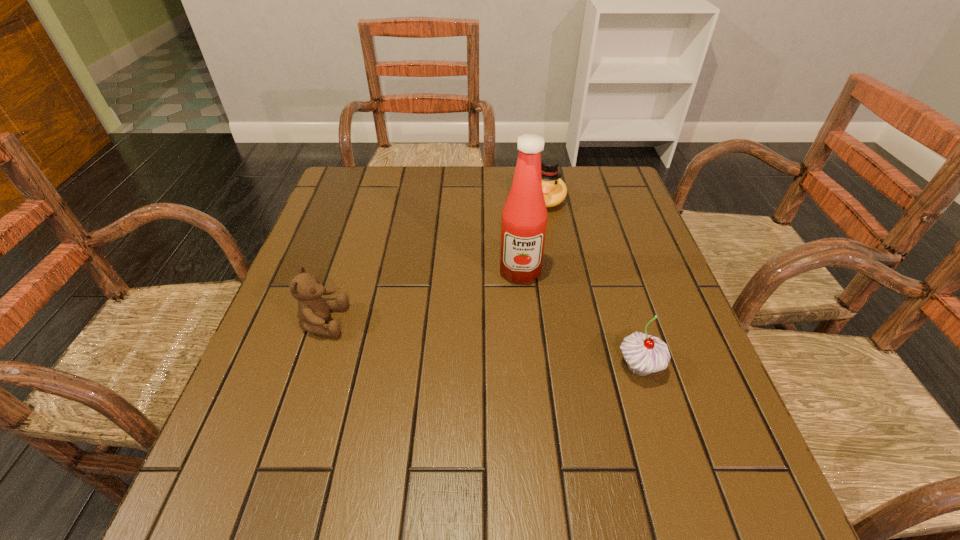
Locate an element on the screen. empty location between the farthest object and the third farthest object is located at coordinates (435, 260).

I want to click on free spot between the third nearest object and the cupcake, so click(x=580, y=319).

Find the location of `object that is the third nearest to the cupcake`. object that is the third nearest to the cupcake is located at coordinates tap(313, 310).

Select which object is the third closest to the duck. Please provide its 2D coordinates. Your answer should be formatted as a tuple, i.e. [(x, y)], where the tuple contains the x and y coordinates of a point satisfying the conditions above.

[(313, 310)]

Locate an element on the screen. vacant space that satisfies the following two spatial constraints: 1. on the back side of the tallest object; 2. on the left side of the farthest object is located at coordinates (514, 199).

Identify the location of free space that satisfies the following two spatial constraints: 1. on the front side of the rightmost object; 2. on the left side of the condiment. (529, 367).